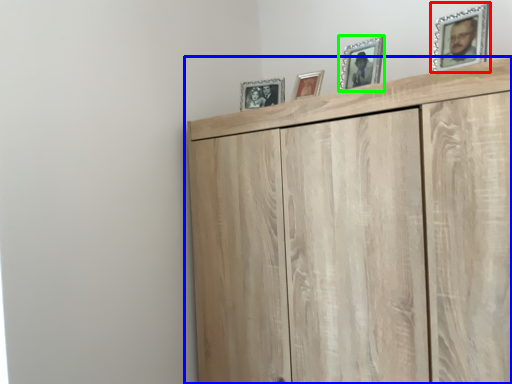
Question: Which object is positioned farthest from picture frame (highlighted by a red box)? Select from cupboard (highlighted by a blue box) and picture frame (highlighted by a green box).

Choices:
 (A) cupboard
 (B) picture frame

Answer: (A)